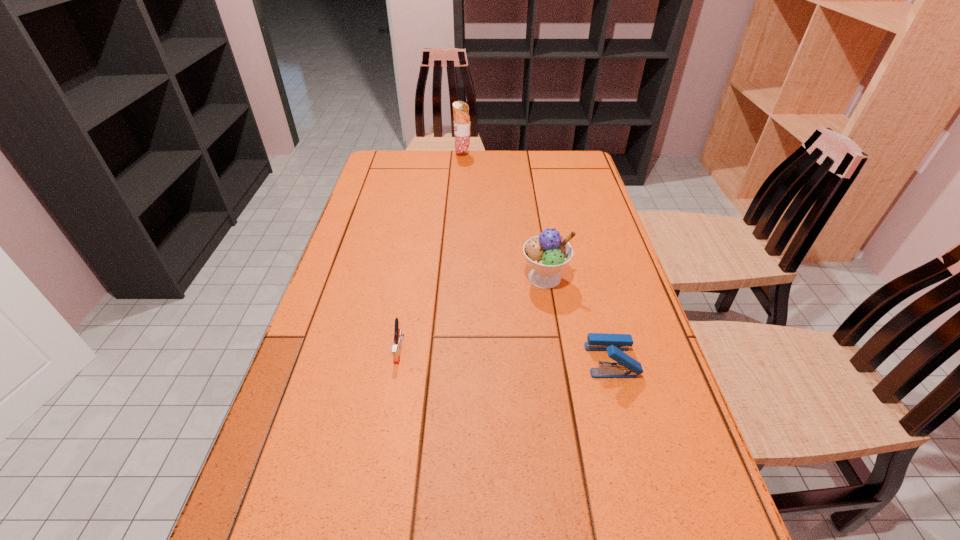
Locate an element on the screen. object located in the far edge section of the desktop is located at coordinates (460, 109).

This screenshot has height=540, width=960. Find the location of `object positioned at the right edge`. object positioned at the right edge is located at coordinates (625, 366).

Locate an element on the screen. The height and width of the screenshot is (540, 960). vacant point at the far edge is located at coordinates click(428, 171).

This screenshot has width=960, height=540. Identify the location of vacant space at the left edge. (353, 239).

Locate an element on the screen. free region at the far right corner is located at coordinates (551, 178).

Where is `free spot between the second tallest object and the leftmost object`? free spot between the second tallest object and the leftmost object is located at coordinates (471, 313).

I want to click on vacant area that lies between the farthest object and the leftmost object, so click(x=431, y=252).

I want to click on vacant area that lies between the left stapler and the burrito, so click(x=431, y=252).

At what (x,y) coordinates should I click in order to perform the action: click on empty space that is in between the rightmost object and the second tallest object. Please return your answer as a coordinate pair (x, y). This screenshot has height=540, width=960. Looking at the image, I should click on (578, 319).

Find the location of a particular element. The width and height of the screenshot is (960, 540). empty space between the leftmost object and the second tallest object is located at coordinates (471, 313).